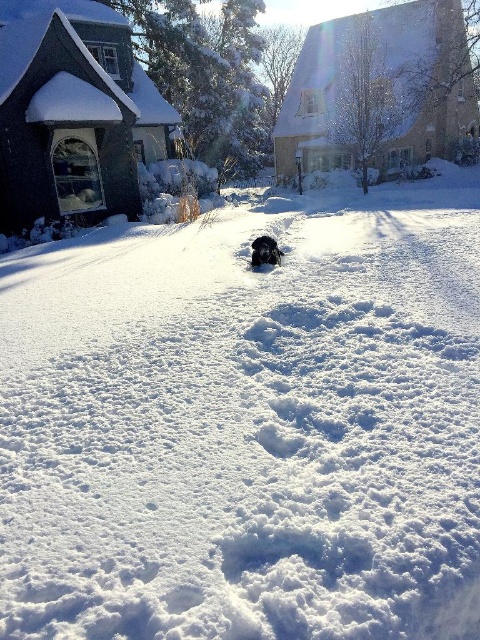
Question: Among these objects, which one is nearest to the camera?

Choices:
 (A) black fur dog at center
 (B) white fluffy snow at center

Answer: (B)

Question: Among these objects, which one is farthest from the camera?

Choices:
 (A) white fluffy snow at center
 (B) black fur dog at center

Answer: (B)

Question: Can you confirm if white fluffy snow at center is wider than black fur dog at center?

Choices:
 (A) yes
 (B) no

Answer: (A)

Question: Does white fluffy snow at center appear under black fur dog at center?

Choices:
 (A) yes
 (B) no

Answer: (B)

Question: Is the position of white fluffy snow at center less distant than that of black fur dog at center?

Choices:
 (A) no
 (B) yes

Answer: (B)